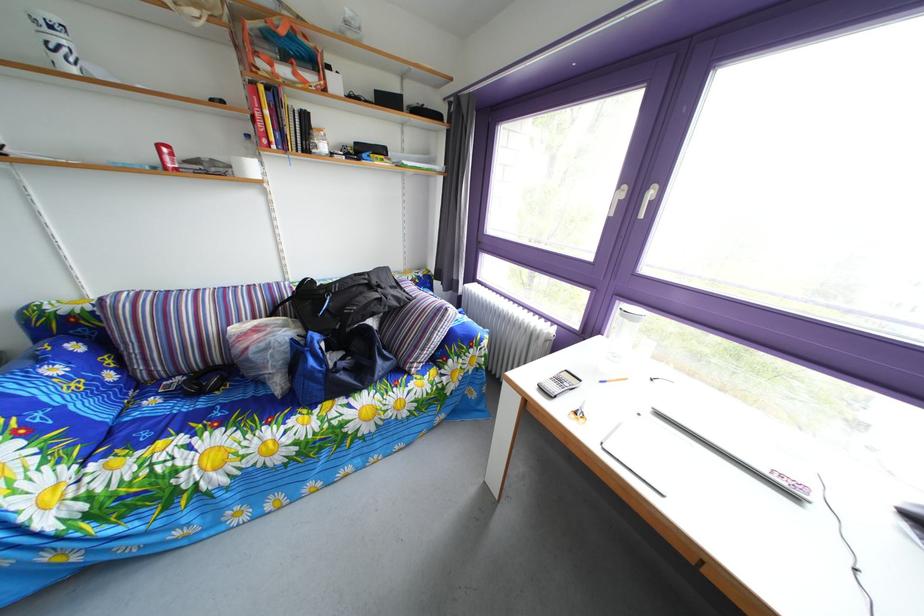
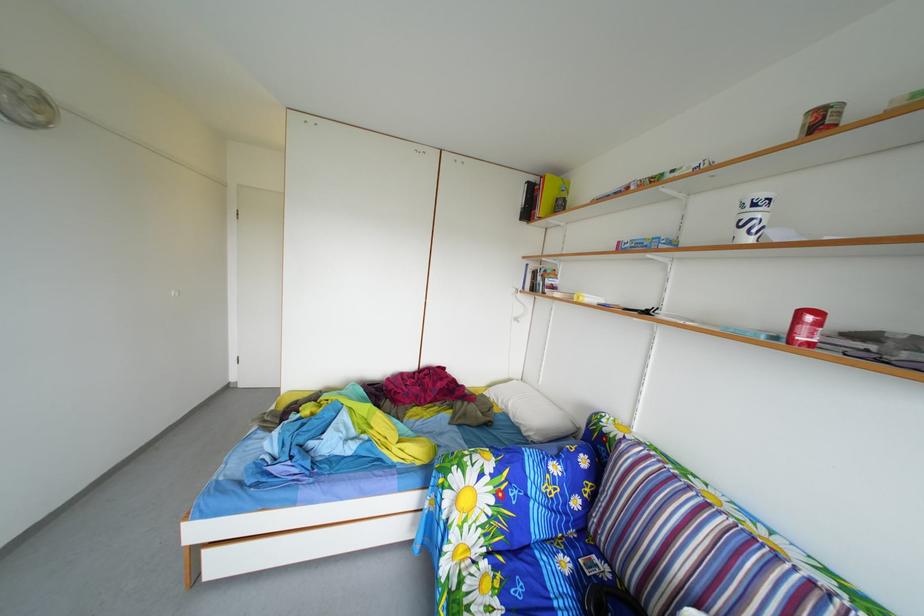
Find the pixel in the second image that matches pixel 164 410 in the first image.

(576, 570)